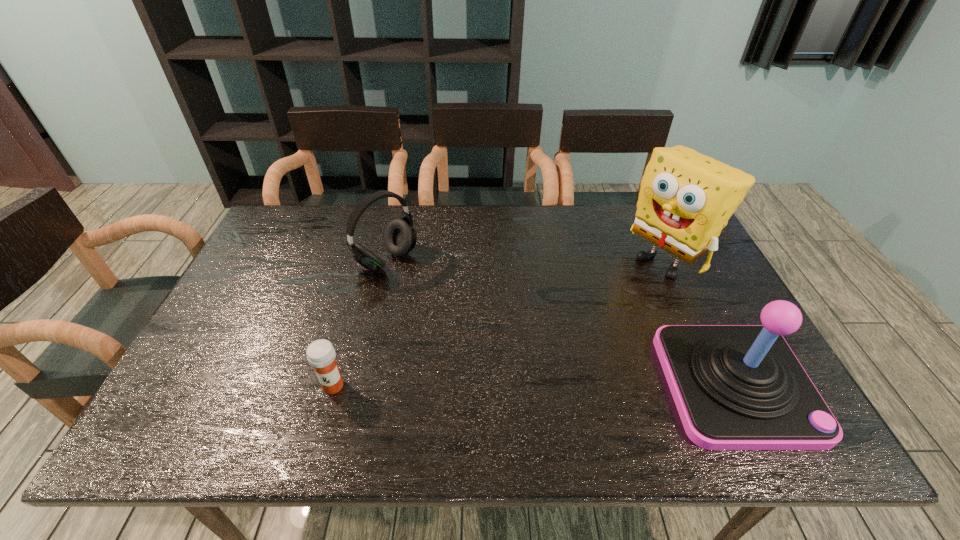
In order to click on sponge located at the far edge in this screenshot , I will do `click(686, 198)`.

At what (x,y) coordinates should I click in order to perform the action: click on headset that is at the far edge. Please return your answer as a coordinate pair (x, y). This screenshot has width=960, height=540. Looking at the image, I should click on click(400, 237).

Locate an element on the screen. Image resolution: width=960 pixels, height=540 pixels. medicine at the near edge is located at coordinates (321, 355).

The image size is (960, 540). I want to click on joystick that is at the near edge, so click(x=736, y=387).

At what (x,y) coordinates should I click in order to perform the action: click on joystick situated at the right edge. Please return your answer as a coordinate pair (x, y). The height and width of the screenshot is (540, 960). Looking at the image, I should click on (736, 387).

This screenshot has width=960, height=540. I want to click on sponge located in the right edge section of the desktop, so click(x=686, y=198).

At what (x,y) coordinates should I click in order to perform the action: click on object present at the far right corner. Please return your answer as a coordinate pair (x, y). This screenshot has width=960, height=540. Looking at the image, I should click on (x=686, y=198).

This screenshot has width=960, height=540. I want to click on object that is at the near right corner, so click(736, 387).

Locate an element on the screen. The height and width of the screenshot is (540, 960). vacant area at the far edge of the desktop is located at coordinates (589, 209).

This screenshot has width=960, height=540. Find the location of `vacant area at the near edge`. vacant area at the near edge is located at coordinates (384, 394).